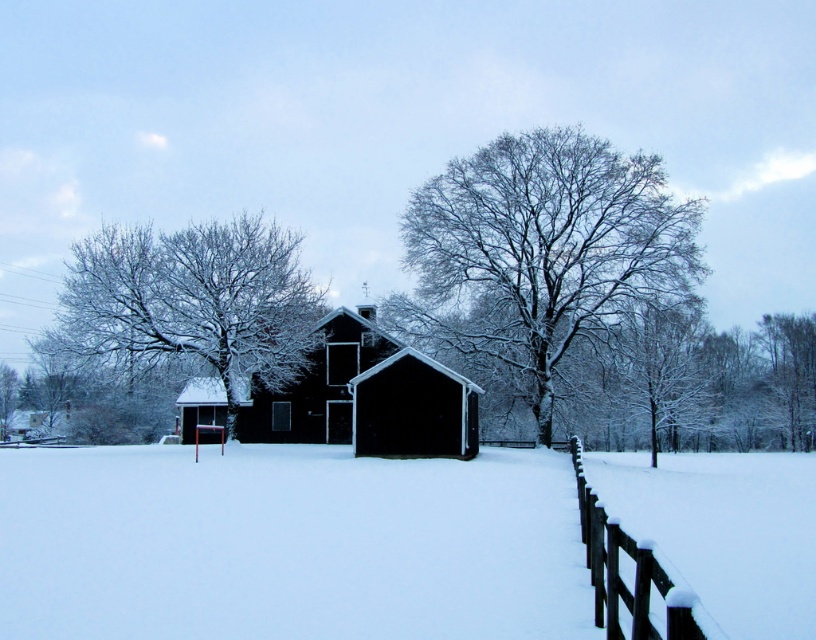
Question: In this image, where is white fluffy snow at center located relative to snow-covered wooden fence at lower right?

Choices:
 (A) above
 (B) below

Answer: (B)

Question: Which of the following is the farthest from the observer?

Choices:
 (A) (777, 342)
 (B) (779, 614)
 (C) (670, 634)
 (D) (242, 404)

Answer: (A)

Question: Is snow-covered branches at center smaller than snow-covered wooden fence at lower right?

Choices:
 (A) no
 (B) yes

Answer: (A)

Question: Which point is farther from the camera taking this photo?

Choices:
 (A) (198, 387)
 (B) (459, 172)

Answer: (A)

Question: Which object appears farthest from the camera in this image?

Choices:
 (A) snow-covered tree at center
 (B) white fluffy snow at center
 (C) snow-covered branches at upper left
 (D) snow-covered wooden fence at lower right

Answer: (A)

Question: Can you confirm if snow-covered branches at center is positioned below snow-covered tree at center?

Choices:
 (A) no
 (B) yes

Answer: (A)